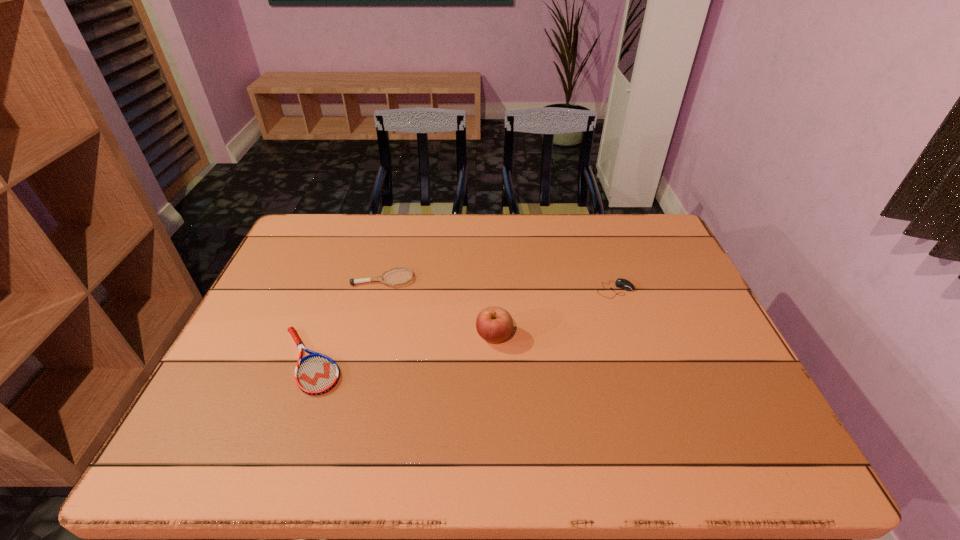
Where is `object that is at the left edge`? Image resolution: width=960 pixels, height=540 pixels. object that is at the left edge is located at coordinates (315, 374).

Image resolution: width=960 pixels, height=540 pixels. Identify the location of vacant space at the far edge of the desktop. (563, 232).

Image resolution: width=960 pixels, height=540 pixels. In the image, there is a desktop. What are the coordinates of `free region at the near edge` in the screenshot? It's located at (342, 468).

Image resolution: width=960 pixels, height=540 pixels. I want to click on vacant space at the left edge, so click(289, 272).

This screenshot has width=960, height=540. I want to click on vacant space at the right edge of the desktop, so click(703, 319).

The height and width of the screenshot is (540, 960). What are the coordinates of `vacant space at the near left corner` in the screenshot? It's located at point(189,442).

The height and width of the screenshot is (540, 960). Identify the location of vacant space at the far right corner of the desktop. (664, 239).

At what (x,y) coordinates should I click in order to perform the action: click on free space between the farther tennis racket and the second object from right to left. Please return your answer as a coordinate pair (x, y). The image size is (960, 540). Looking at the image, I should click on (439, 308).

This screenshot has height=540, width=960. I want to click on free spot between the computer mouse and the second object from right to left, so click(555, 313).

Locate an element on the screen. vacant point located between the farther tennis racket and the shortest object is located at coordinates (347, 320).